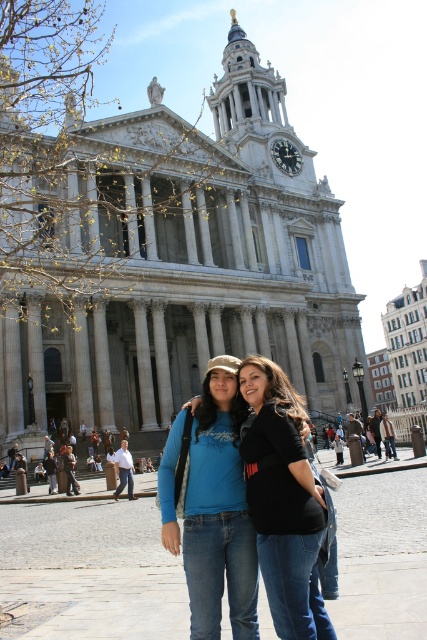
Question: Is matte blue shirt at center behind denim jeans at center?

Choices:
 (A) no
 (B) yes

Answer: (B)

Question: Is matte blue shirt at center above denim jeans at center?

Choices:
 (A) yes
 (B) no

Answer: (B)

Question: Which point is closer to the camera taking this photo?

Choices:
 (A) (286, 512)
 (B) (193, 497)

Answer: (A)

Question: Can you confirm if matte blue shirt at center is positioned to the right of denim jeans at center?

Choices:
 (A) no
 (B) yes

Answer: (A)

Question: Which point is farther to the camera?

Choices:
 (A) (263, 372)
 (B) (198, 572)

Answer: (A)